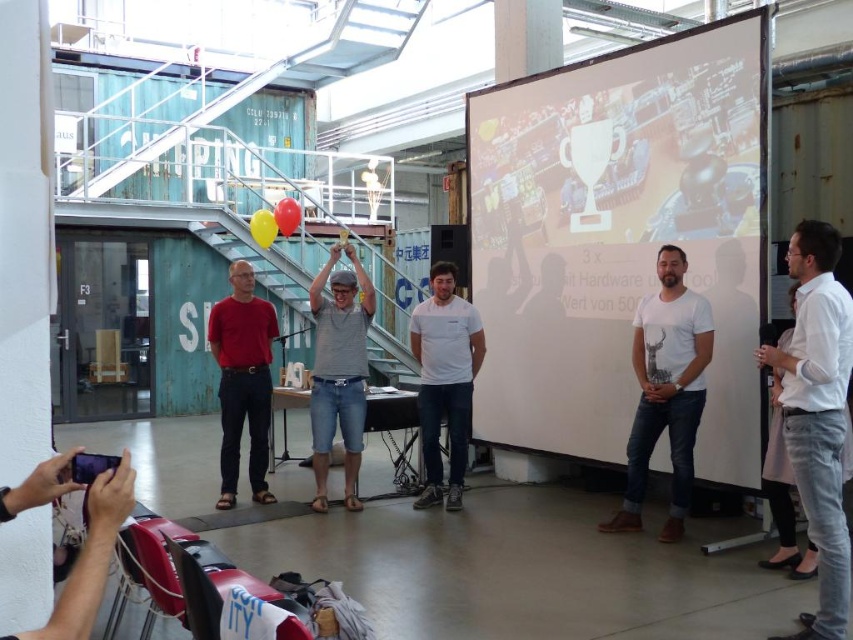
How distant is white shirt at right from matte red shirt at center?

A distance of 3.99 meters exists between white shirt at right and matte red shirt at center.

Is white shirt at right further to camera compared to matte red shirt at center?

That is False.

Where is `white shirt at right`? The width and height of the screenshot is (853, 640). white shirt at right is located at coordinates (817, 413).

Can you confirm if white shirt at right is positioned below white cotton t-shirt at center?

Incorrect, white shirt at right is not positioned below white cotton t-shirt at center.

Is white shirt at right bigger than white cotton t-shirt at center?

No, white shirt at right is not bigger than white cotton t-shirt at center.

Between point (834, 280) and point (451, 499), which one is positioned in front?

Point (834, 280) is in front.

Locate an element on the screen. The height and width of the screenshot is (640, 853). white shirt at right is located at coordinates (817, 413).

Which is more to the left, white matte projection screen at center or matte red shirt at center?

matte red shirt at center

Which is above, white matte projection screen at center or matte red shirt at center?

white matte projection screen at center is higher up.

Where is `white matte projection screen at center`? Image resolution: width=853 pixels, height=640 pixels. white matte projection screen at center is located at coordinates (619, 236).

I want to click on white matte projection screen at center, so 619,236.